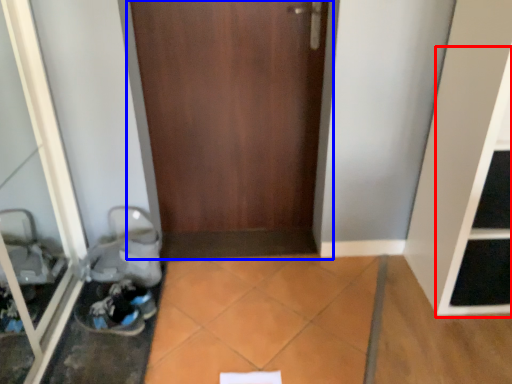
Question: Among these objects, which one is farthest to the camera, shelf (highlighted by a red box) or door (highlighted by a blue box)?

Choices:
 (A) shelf
 (B) door

Answer: (B)